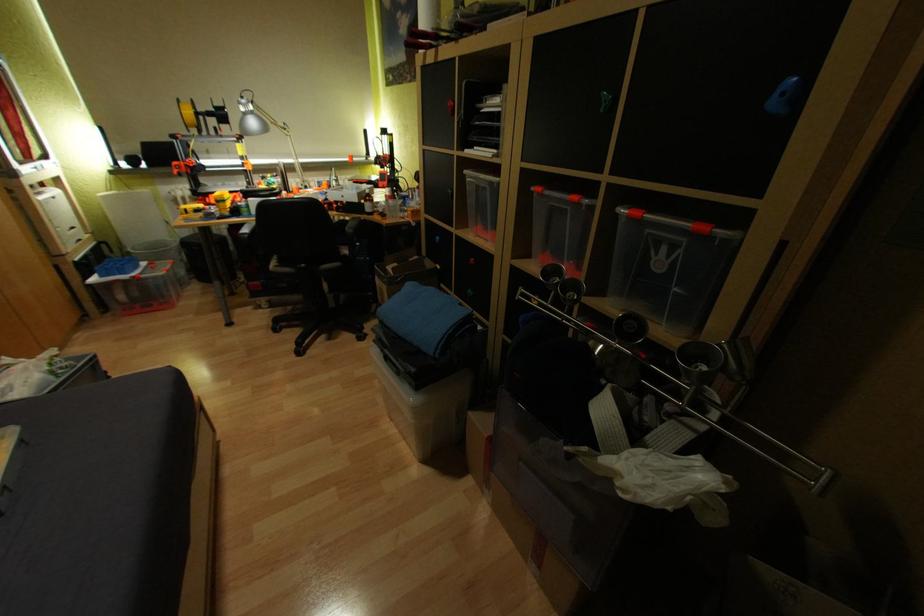
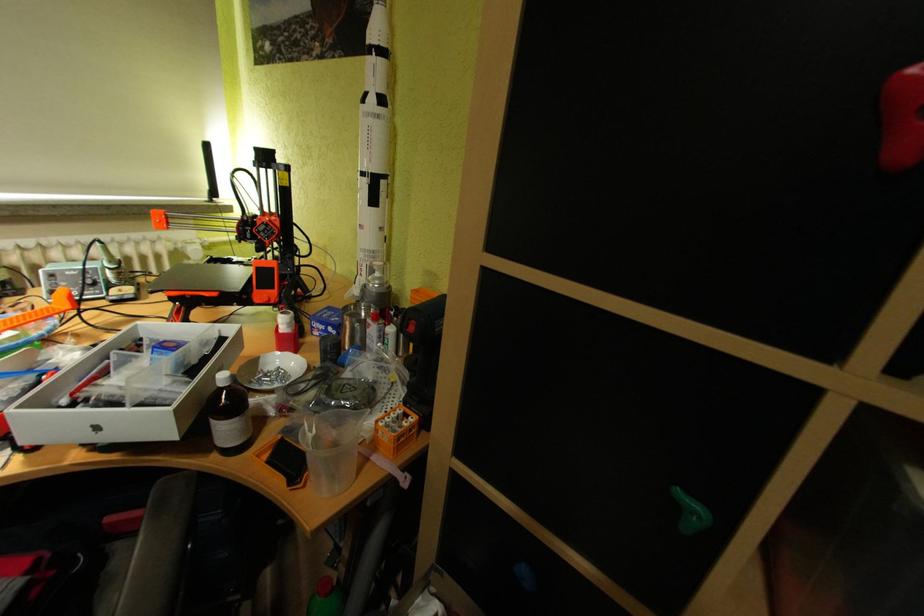
Question: What movement of the cameraman would produce the second image?

Choices:
 (A) Left
 (B) Right
 (C) Forward
 (D) Backward

Answer: (C)